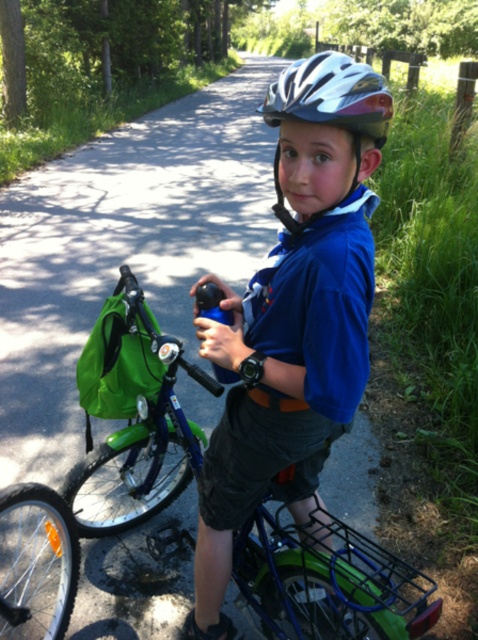
Does point (256, 349) come closer to viewer compared to point (329, 72)?

No, it is not.

This screenshot has height=640, width=478. In order to click on blue fabric shirt at center in this screenshot , I will do `click(293, 316)`.